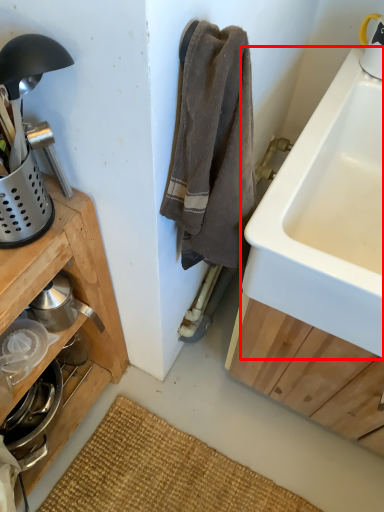
Question: From the image, what is the correct spatial relationship of sink (annotated by the red box) in relation to appliance?

Choices:
 (A) right
 (B) left

Answer: (A)